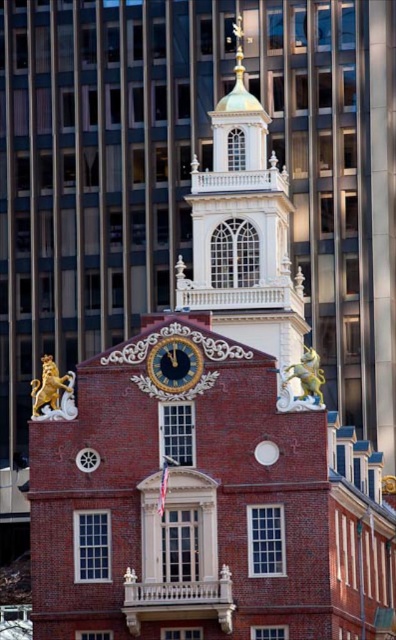
Can you confirm if gold metallic clock at center is smaller than gold polished metal lion at upper left?

Yes, gold metallic clock at center is smaller than gold polished metal lion at upper left.

Who is positioned more to the left, gold metallic clock at center or gold polished metal lion at upper left?

gold polished metal lion at upper left is more to the left.

Find the location of a particular element. This screenshot has width=396, height=640. gold metallic clock at center is located at coordinates (175, 364).

Locate an element on the screen. This screenshot has height=640, width=396. gold metallic clock at center is located at coordinates (175, 364).

Is point (222, 266) positioned in front of point (312, 349)?

No, (222, 266) is behind (312, 349).

Is point (224, 180) behind point (310, 387)?

Yes, point (224, 180) is farther from viewer.

Locate an element on the screen. This screenshot has height=640, width=396. gold/gilded metal bell tower at upper center is located at coordinates (243, 232).

From the picture: Can you confirm if gold metallic clock at center is bigger than gold polished metal horse at upper right?

No, gold metallic clock at center is not bigger than gold polished metal horse at upper right.

Who is lower down, gold metallic clock at center or gold polished metal horse at upper right?

gold metallic clock at center is lower down.

Is point (150, 362) closer to viewer compared to point (302, 385)?

No, it is not.

The width and height of the screenshot is (396, 640). Find the location of `gold metallic clock at center`. gold metallic clock at center is located at coordinates (175, 364).